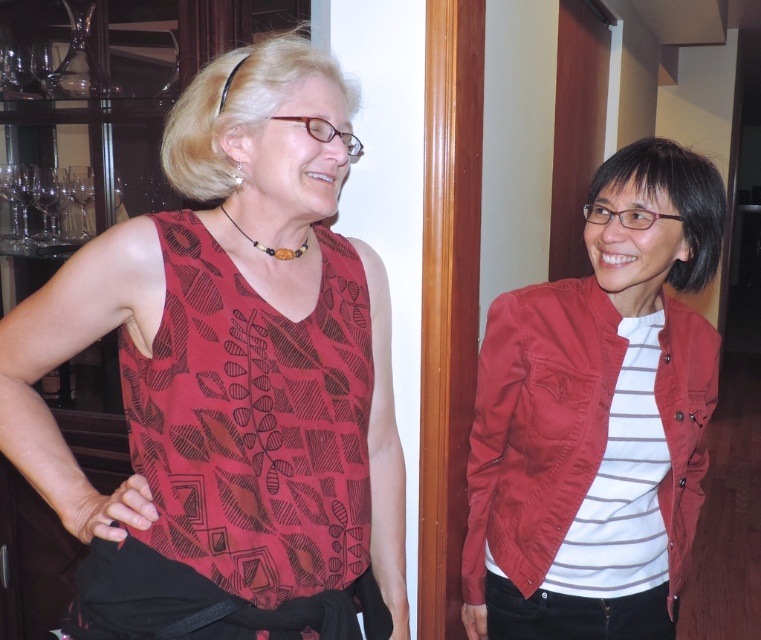
Question: Which of the following is the closest to the observer?

Choices:
 (A) (282, 72)
 (B) (629, 467)

Answer: (A)

Question: Considering the relative positions of matte red jacket at right and white striped fabric shirt at right in the image provided, where is matte red jacket at right located with respect to white striped fabric shirt at right?

Choices:
 (A) above
 (B) below

Answer: (B)

Question: Which point is farther from the camera taking this photo?

Choices:
 (A) (27, 406)
 (B) (648, 460)

Answer: (B)

Question: Does matte red tank top at left lie behind matte red jacket at right?

Choices:
 (A) no
 (B) yes

Answer: (A)

Question: From the image, what is the correct spatial relationship of matte red jacket at right in relation to white striped fabric shirt at right?

Choices:
 (A) left
 (B) right

Answer: (A)

Question: Which object appears closest to the camera in this image?

Choices:
 (A) matte red jacket at right
 (B) matte red tank top at left

Answer: (B)